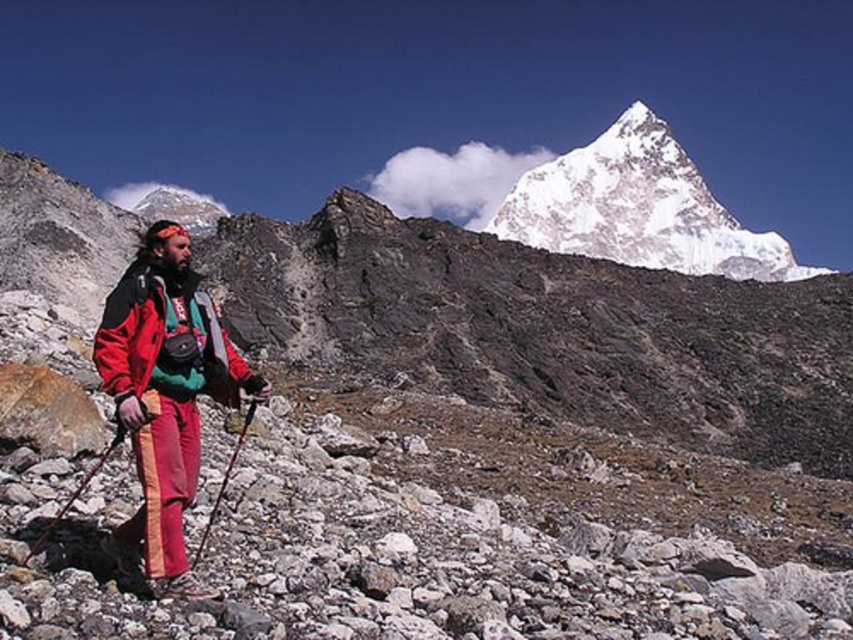
Consider the image. Which of these two, matte red ski suit at left or matte red jacket at center, stands shorter?

matte red jacket at center is shorter.

Does point (137, 332) come behind point (158, 390)?

No, it is in front of (158, 390).

At what (x,y) coordinates should I click in order to perform the action: click on matte red ski suit at left. Please return your answer as a coordinate pair (x, y). Looking at the image, I should click on point(165,394).

Between point (225, 352) and point (236, 436), which one is positioned behind?

Point (236, 436)

Can you confirm if matte red jacket at center is taller than matte black ski pole at center?

Yes.

Is point (161, 353) closer to viewer compared to point (224, 486)?

Yes, it is in front of point (224, 486).

Locate an element on the screen. matte red jacket at center is located at coordinates (166, 339).

Is point (664, 141) closer to viewer compared to point (193, 556)?

No, it is not.

Who is positioned more to the right, white snow-covered peak at upper center or matte black ski pole at center?

From the viewer's perspective, white snow-covered peak at upper center appears more on the right side.

Between point (583, 216) and point (236, 435), which one is positioned in front?

Point (236, 435) is more forward.

Locate an element on the screen. white snow-covered peak at upper center is located at coordinates (637, 209).